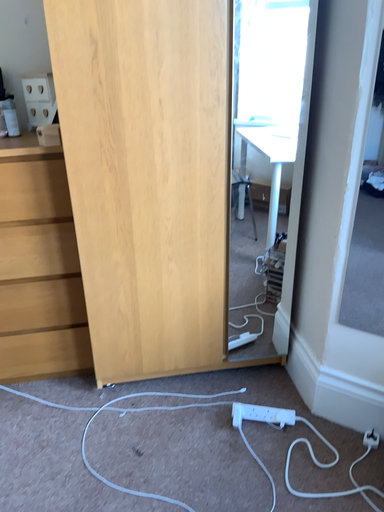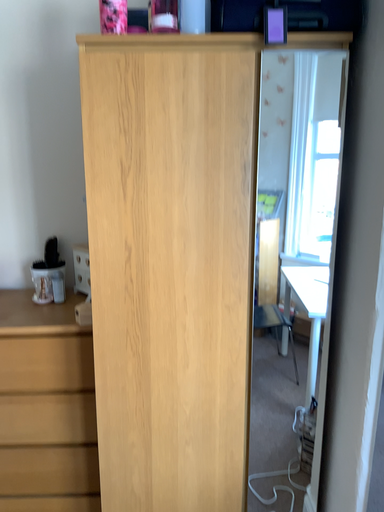
Question: Which way did the camera rotate in the video?

Choices:
 (A) rotated downward
 (B) rotated upward

Answer: (B)